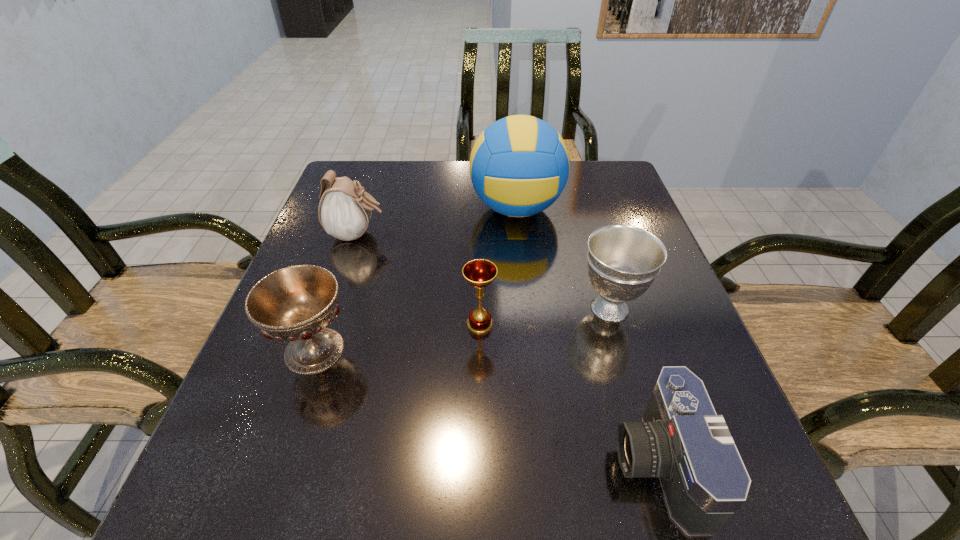
Where is `camera positioned at the right edge`? camera positioned at the right edge is located at coordinates (682, 440).

Locate an element on the screen. The image size is (960, 540). object situated at the near right corner is located at coordinates (682, 440).

In the image, there is a desktop. Where is `blank space at the far edge`? The image size is (960, 540). blank space at the far edge is located at coordinates (412, 180).

Locate an element on the screen. free region at the left edge is located at coordinates (293, 401).

Locate an element on the screen. This screenshot has height=540, width=960. vacant space at the far left corner of the desktop is located at coordinates (376, 189).

Where is `blank space at the near left corner`? This screenshot has width=960, height=540. blank space at the near left corner is located at coordinates (266, 502).

The width and height of the screenshot is (960, 540). In the image, there is a desktop. What are the coordinates of `vacant space at the far right corner` in the screenshot? It's located at (576, 167).

Identify the location of blank region between the shortest object and the leftmost chalice. (486, 407).

You are a GUI agent. You are given a task and a screenshot of the screen. Output one action in this format:
    pyautogui.click(x=<x>, y=<y>)
    Task: Click on the free space between the second chalice from left to right and the rightmost chalice
    
    Given the screenshot: What is the action you would take?
    pyautogui.click(x=545, y=316)

Where is `vacant area between the leftmost chalice and the second chalice from left to right`? The width and height of the screenshot is (960, 540). vacant area between the leftmost chalice and the second chalice from left to right is located at coordinates (397, 338).